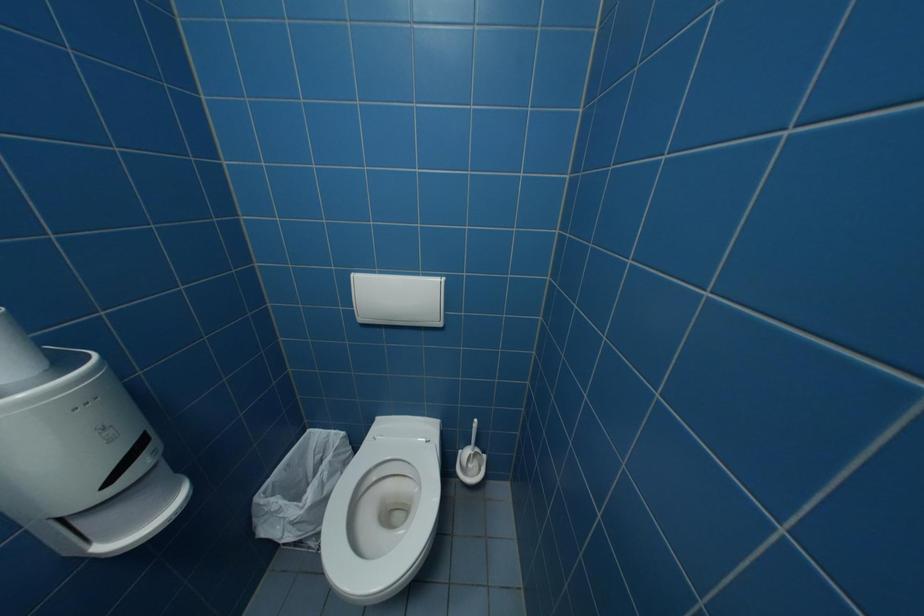
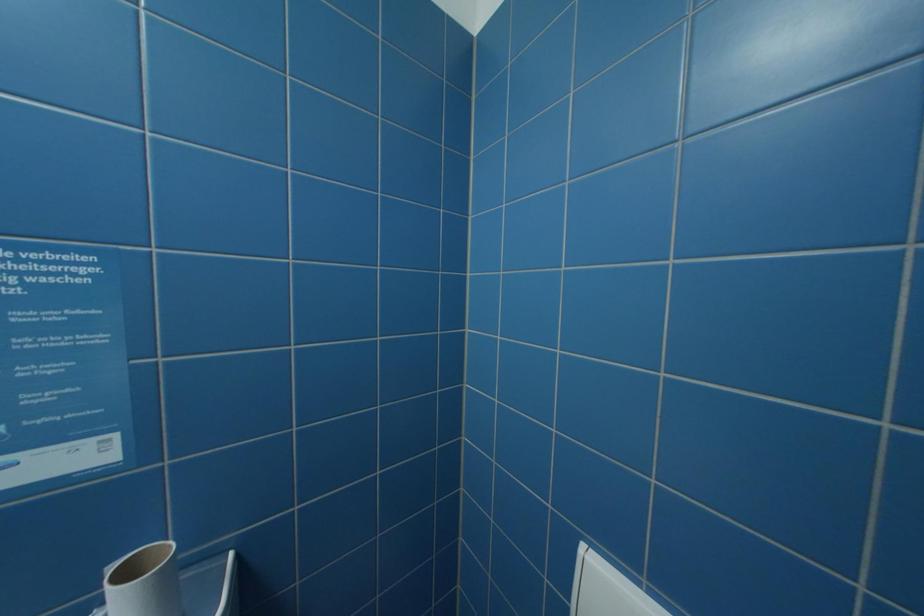
Question: The camera is either moving clockwise (left) or counter-clockwise (right) around the object. The first image is from the beginning of the video and the second image is from the end. Is the camera moving left or right when shooting the video?

Choices:
 (A) Left
 (B) Right

Answer: (B)